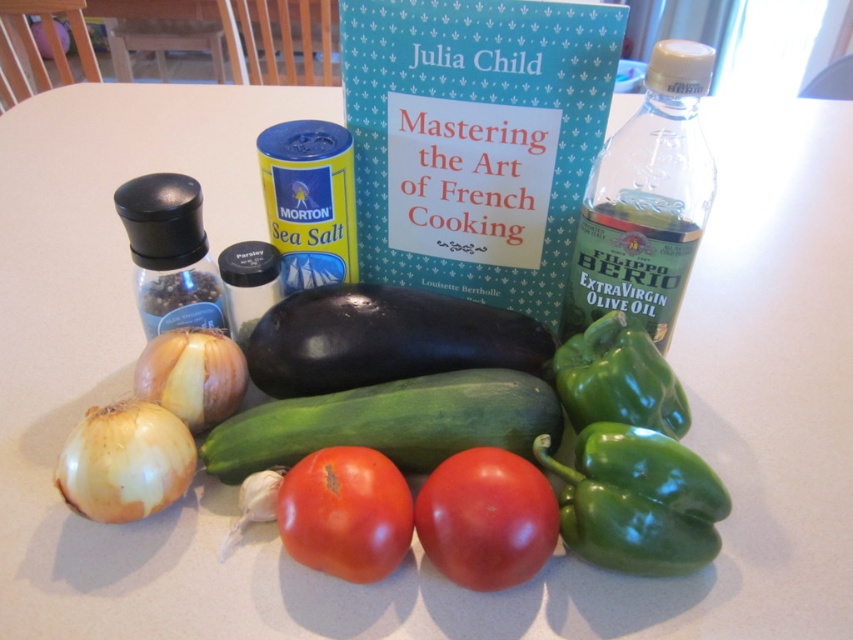
Question: Can you confirm if green matte bell pepper at lower right is thinner than green matte bell pepper at center right?

Choices:
 (A) yes
 (B) no

Answer: (B)

Question: Which point appears farthest from the camera in this image?

Choices:
 (A) (244, 492)
 (B) (509, 317)
 (C) (163, 397)
 (D) (593, 186)

Answer: (B)

Question: Which object is the farthest from the white matte garlic at center?

Choices:
 (A) red matte tomato at center
 (B) smooth brown onion at lower left
 (C) black glass pepper grinder at left

Answer: (C)

Question: Is shiny dark purple eggplant at center wider than green matte bell pepper at lower right?

Choices:
 (A) yes
 (B) no

Answer: (A)

Question: Which point is farther from the camera taking this photo?

Choices:
 (A) (178, 337)
 (B) (200, 449)

Answer: (A)

Question: Does green smooth cucumber at center appear on the right side of green matte bell pepper at center right?

Choices:
 (A) yes
 (B) no

Answer: (B)